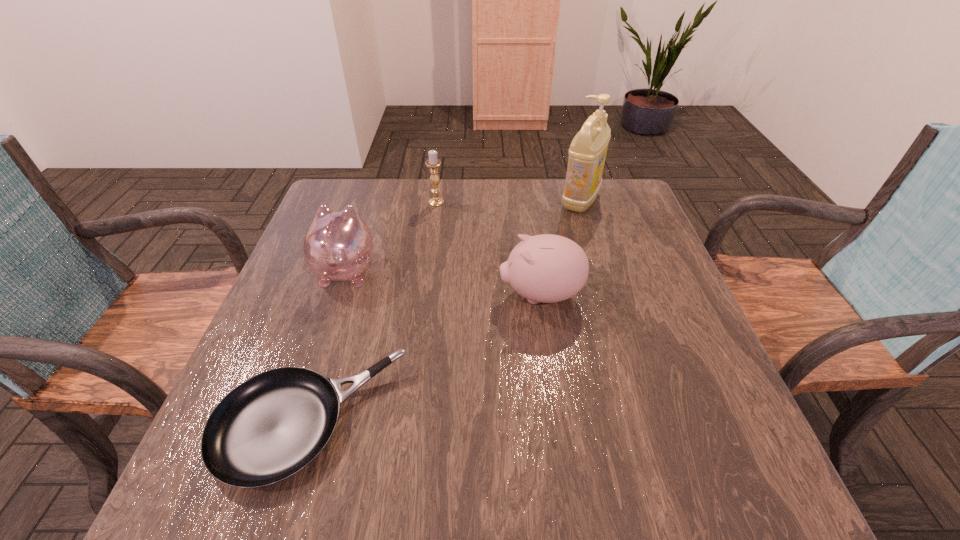
In order to click on object positioned at the right edge in this screenshot , I will do `click(587, 153)`.

At what (x,y) coordinates should I click in order to perform the action: click on object that is positioned at the near left corner. Please return your answer as a coordinate pair (x, y). This screenshot has width=960, height=540. Looking at the image, I should click on (268, 428).

Where is `object that is at the far right corner`? The image size is (960, 540). object that is at the far right corner is located at coordinates (587, 153).

At what (x,y) coordinates should I click in order to perform the action: click on vacant area at the far edge of the desktop. Please return your answer as a coordinate pair (x, y). The image size is (960, 540). Looking at the image, I should click on (567, 213).

In the image, there is a desktop. What are the coordinates of `vacant space at the left edge` in the screenshot? It's located at (321, 332).

Find the location of a particular element. This screenshot has height=540, width=960. free space at the right edge of the desktop is located at coordinates (671, 272).

Identify the location of vacant space at the far right corner of the desktop. (627, 192).

Image resolution: width=960 pixels, height=540 pixels. I want to click on free spot between the left piggy bank and the right piggy bank, so click(x=444, y=282).

Locate an element on the screen. The width and height of the screenshot is (960, 540). vacant area that lies between the shortest object and the left piggy bank is located at coordinates (327, 346).

Find the location of a particular element. The width and height of the screenshot is (960, 540). free spot between the right piggy bank and the candle holder is located at coordinates (489, 249).